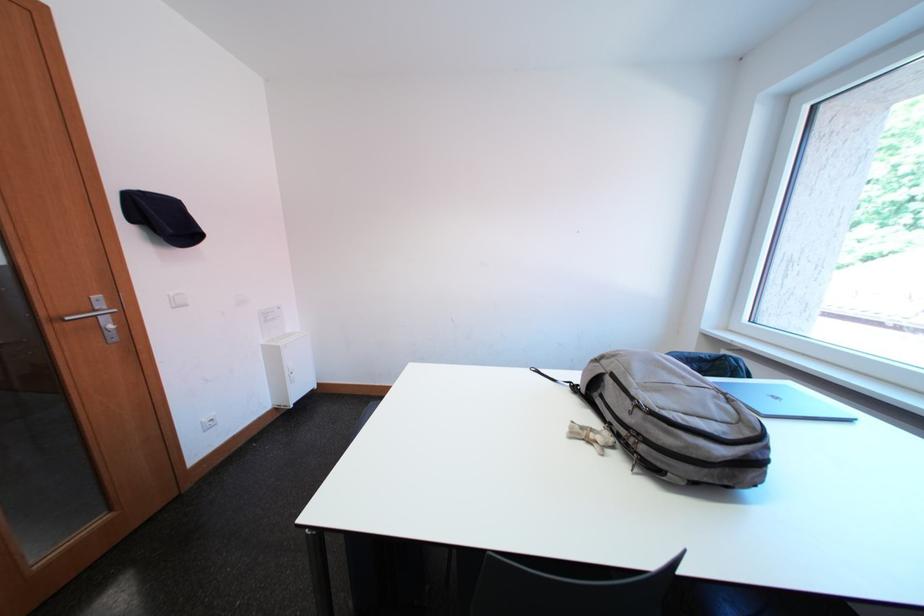
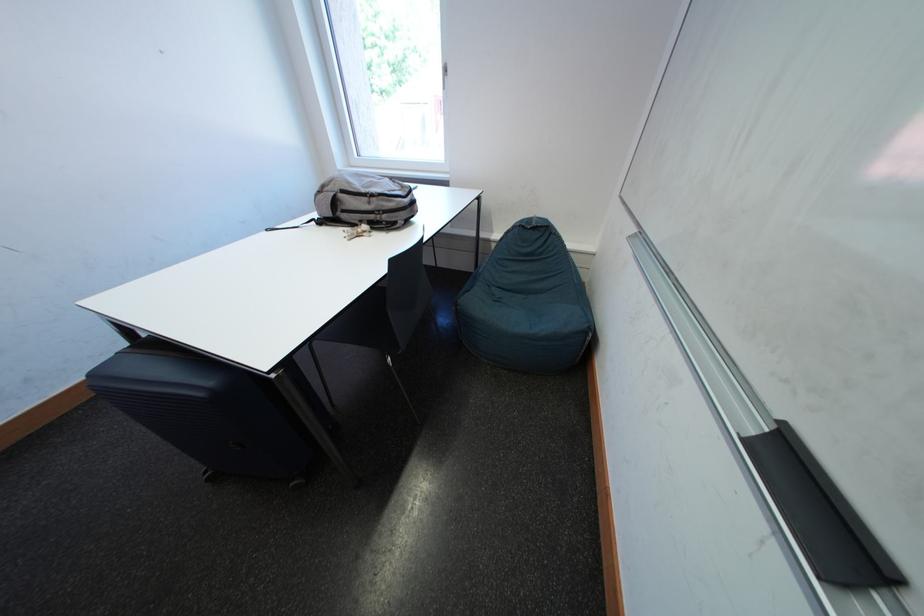
Where in the second image is the point corresponding to the point at 732,455 from the first image?

(416, 204)